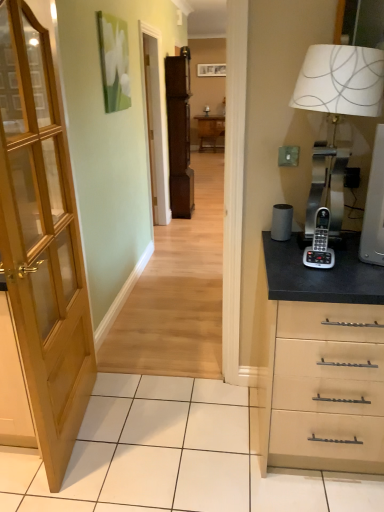
Identify the location of free space below brown wood file cabinet at center (from a real-world perspective). (196, 207).